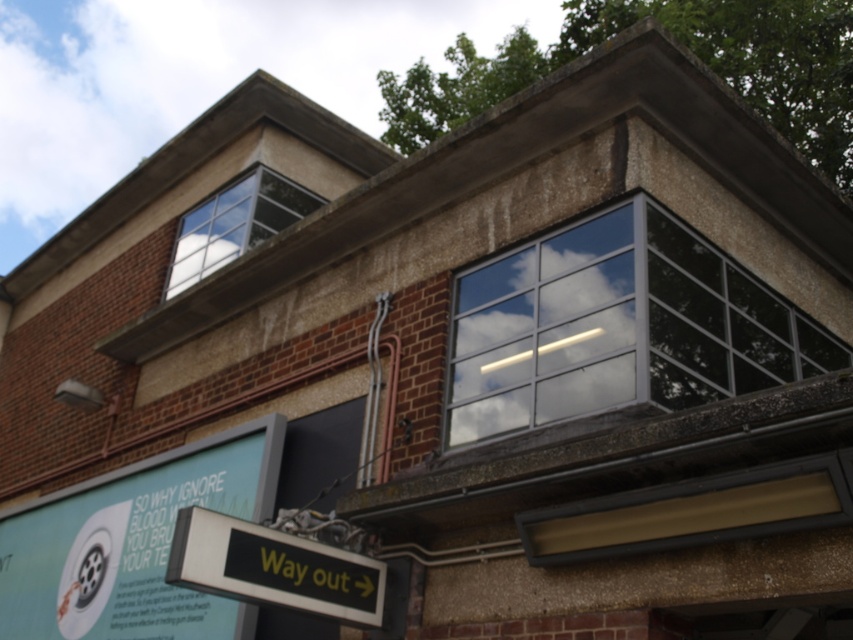
Question: Can you confirm if green plastic sign at center is positioned to the right of clear glass window at upper left?

Choices:
 (A) no
 (B) yes

Answer: (B)

Question: Which point appears closest to the camera in this image?

Choices:
 (A) (200, 573)
 (B) (572, 408)

Answer: (A)

Question: Which is nearer to the clear glass window at upper left?

Choices:
 (A) clear glass window at upper right
 (B) green plastic sign at center
 (C) green matte signboard at lower left

Answer: (C)

Question: Is clear glass window at upper right to the right of clear glass window at upper left from the viewer's perspective?

Choices:
 (A) no
 (B) yes

Answer: (B)

Question: Which object is closer to the camera taking this photo?

Choices:
 (A) green plastic sign at center
 (B) clear glass window at upper left
 (C) clear glass window at upper right

Answer: (A)

Question: Where is green matte signboard at lower left located in relation to green plastic sign at center in the image?

Choices:
 (A) above
 (B) below

Answer: (B)